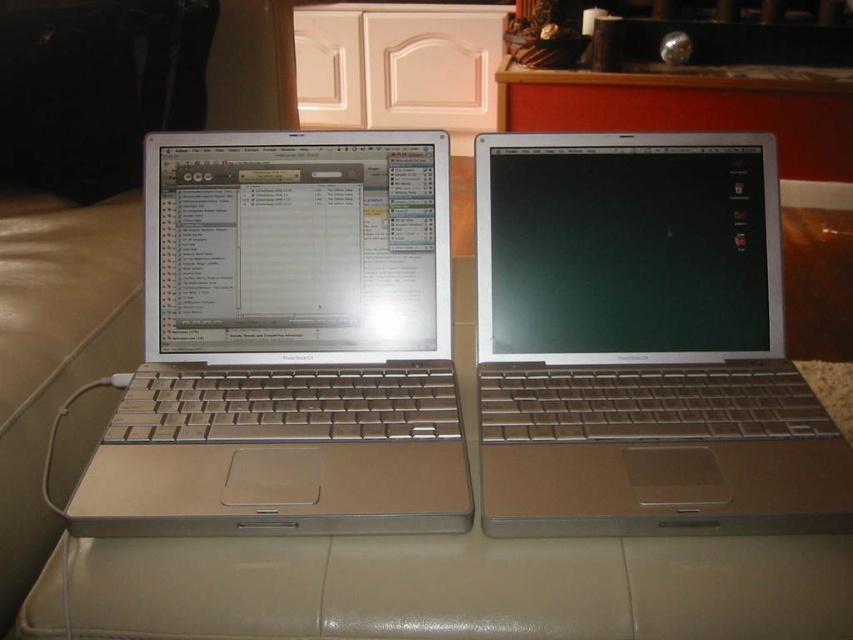
You are organizing a tech event and need to place a new laptop between the silver metallic laptop at left and the satin silver laptop at center. Is there enough space for the new laptop?

The silver metallic laptop at left is to the left of the satin silver laptop at center, so there is space between them to place a new laptop.

You are standing in front of the two laptops on the light colored leather surface. You want to reach the point at coordinates point (175, 269). If your hand can extend 30 inches, can you comfortably reach that point?

The point (175, 269) is 30.29 inches away from the viewer. Since your hand can only extend 30 inches, you cannot comfortably reach that point.

You are a delivery person who needs to place a 6.5 inch long package between the silver metallic laptop at left and the satin silver laptop at center. Can you fit the package between them without moving either laptop?

The space between the silver metallic laptop at left and the satin silver laptop at center is 6.38 inches. Since the package is 6.5 inches long, which is slightly longer than the available space, it won me not fit between them without moving the laptops.